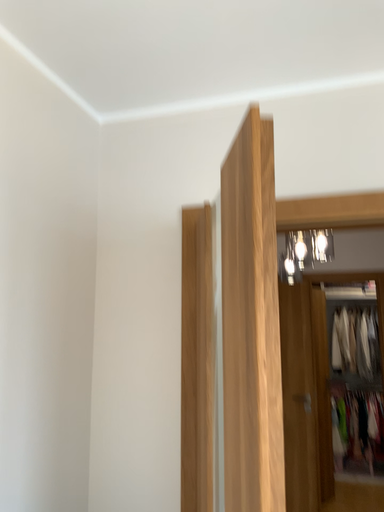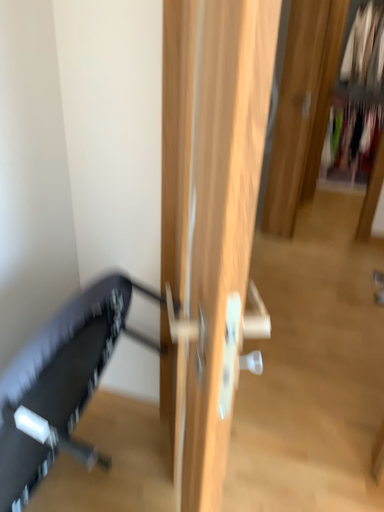
Question: Which way did the camera rotate in the video?

Choices:
 (A) rotated downward
 (B) rotated upward

Answer: (A)